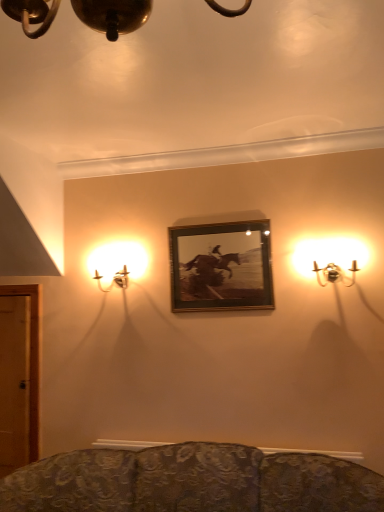
Question: Can you confirm if wooden frame at center is positioned to the right of metallic wall sconce at right, marked as the first lamp in a front-to-back arrangement?

Choices:
 (A) no
 (B) yes

Answer: (A)

Question: Is wooden frame at center located outside metallic wall sconce at right, which appears as the 2th lamp when viewed from the back?

Choices:
 (A) yes
 (B) no

Answer: (A)

Question: Does wooden frame at center have a greater height compared to metallic wall sconce at right, positioned as the second lamp in left-to-right order?

Choices:
 (A) no
 (B) yes

Answer: (B)

Question: From the image's perspective, is wooden frame at center over metallic wall sconce at right, acting as the first lamp starting from the right?

Choices:
 (A) yes
 (B) no

Answer: (B)

Question: Considering the relative sizes of wooden frame at center and metallic wall sconce at right, acting as the first lamp starting from the right, in the image provided, is wooden frame at center shorter than metallic wall sconce at right, acting as the first lamp starting from the right,?

Choices:
 (A) no
 (B) yes

Answer: (A)

Question: Considering the relative sizes of wooden frame at center and metallic wall sconce at right, marked as the first lamp in a front-to-back arrangement, in the image provided, is wooden frame at center bigger than metallic wall sconce at right, marked as the first lamp in a front-to-back arrangement,?

Choices:
 (A) yes
 (B) no

Answer: (B)

Question: Does metallic wall sconce at right, which appears as the 2th lamp when viewed from the back, turn towards wooden frame at center?

Choices:
 (A) no
 (B) yes

Answer: (A)

Question: From the image's perspective, is metallic wall sconce at right, which appears as the 2th lamp when viewed from the back, on wooden frame at center?

Choices:
 (A) no
 (B) yes

Answer: (B)

Question: Would you say metallic wall sconce at right, acting as the first lamp starting from the right, contains wooden frame at center?

Choices:
 (A) no
 (B) yes

Answer: (A)

Question: Can you confirm if metallic wall sconce at right, positioned as the second lamp in left-to-right order, is wider than wooden frame at center?

Choices:
 (A) no
 (B) yes

Answer: (B)

Question: Is metallic wall sconce at right, positioned as the second lamp in left-to-right order, smaller than wooden frame at center?

Choices:
 (A) yes
 (B) no

Answer: (B)

Question: Is metallic wall sconce at right, marked as the first lamp in a front-to-back arrangement, further to the viewer compared to wooden frame at center?

Choices:
 (A) yes
 (B) no

Answer: (B)

Question: Are metallic gold sconce at left, the second lamp positioned from the right, and metallic wall sconce at right, acting as the first lamp starting from the right, far apart?

Choices:
 (A) yes
 (B) no

Answer: (A)